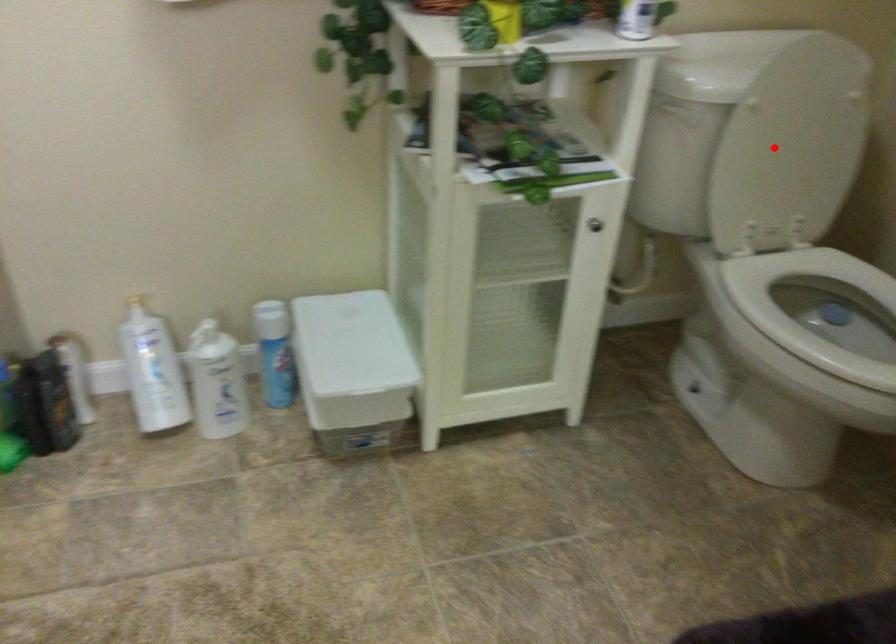
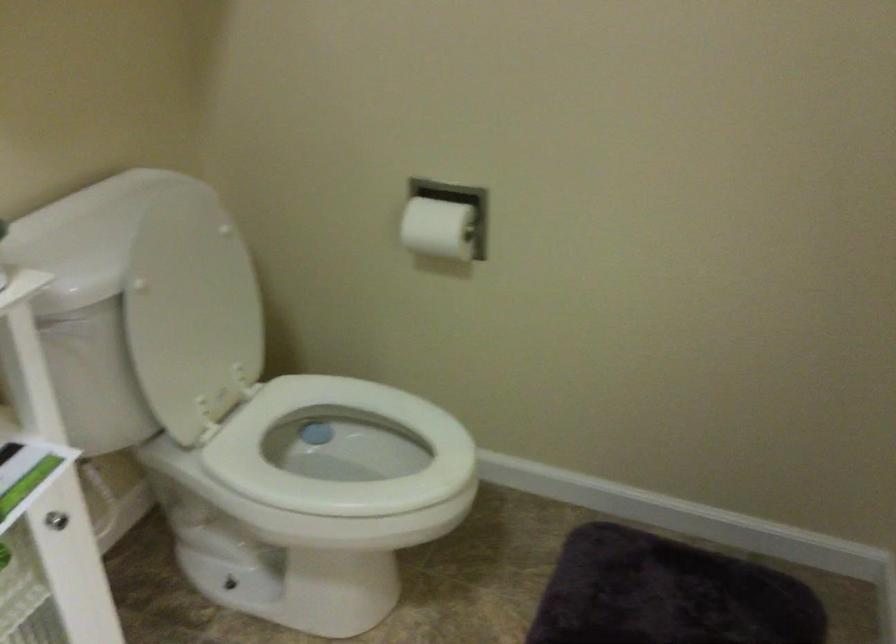
Question: I am providing you with two images of the same scene from different viewpoints. In image1, a red point is highlighted. Considering the same 3D point in image2, which of the following is correct?

Choices:
 (A) It is closer
 (B) It is farther

Answer: (A)